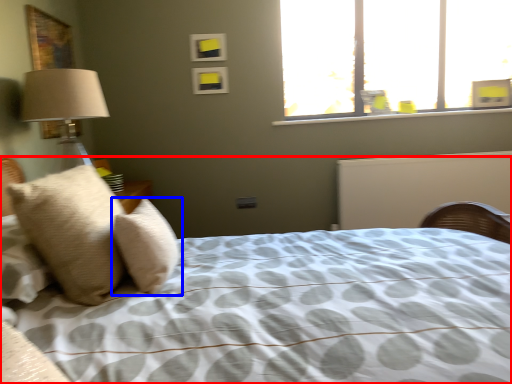
Question: Among these objects, which one is farthest to the camera, bed (highlighted by a red box) or pillow (highlighted by a blue box)?

Choices:
 (A) bed
 (B) pillow

Answer: (B)